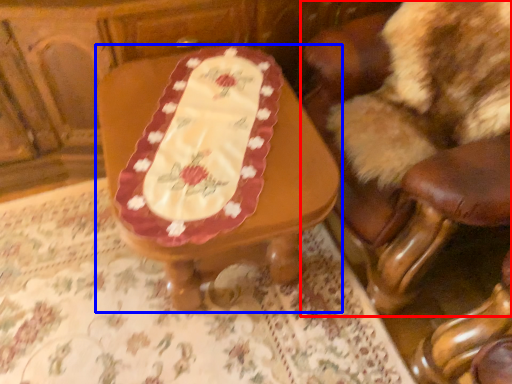
Question: Which point is closer to the camera, chair (highlighted by a red box) or table (highlighted by a blue box)?

Choices:
 (A) chair
 (B) table

Answer: (A)